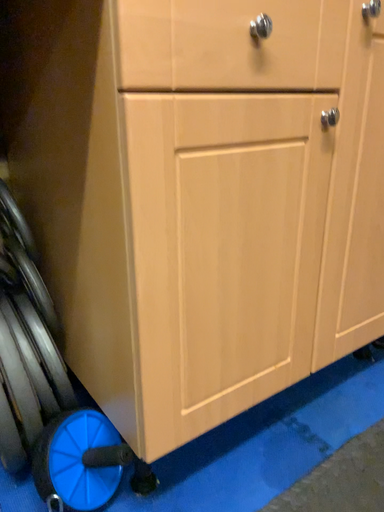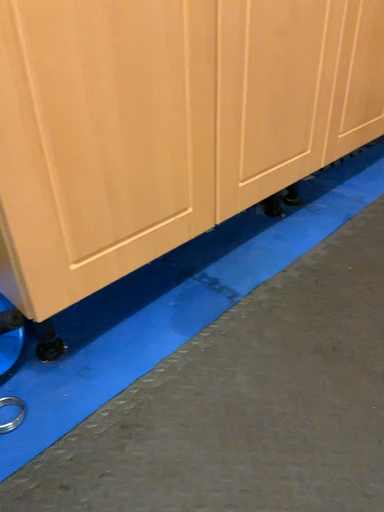
Question: How did the camera likely rotate when shooting the video?

Choices:
 (A) rotated left
 (B) rotated right

Answer: (B)